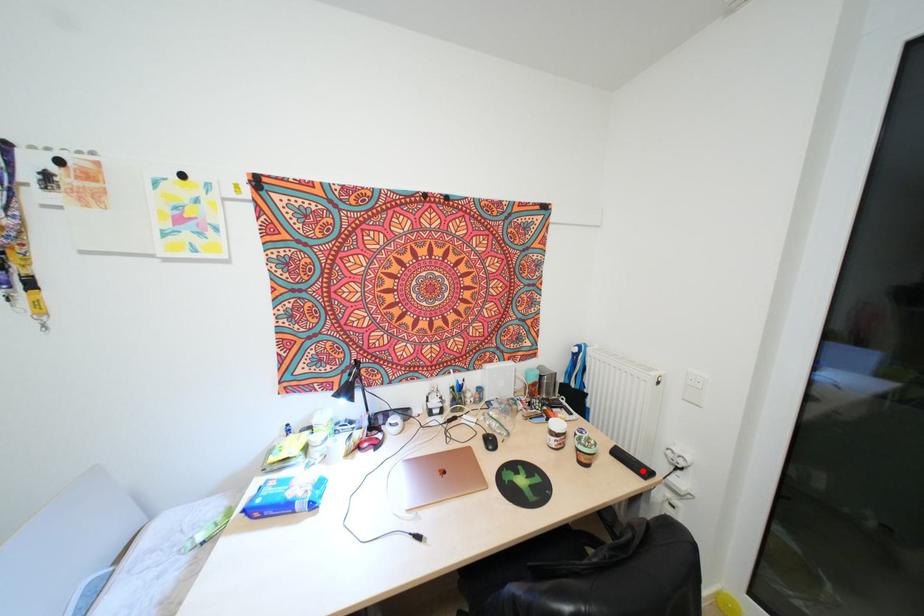
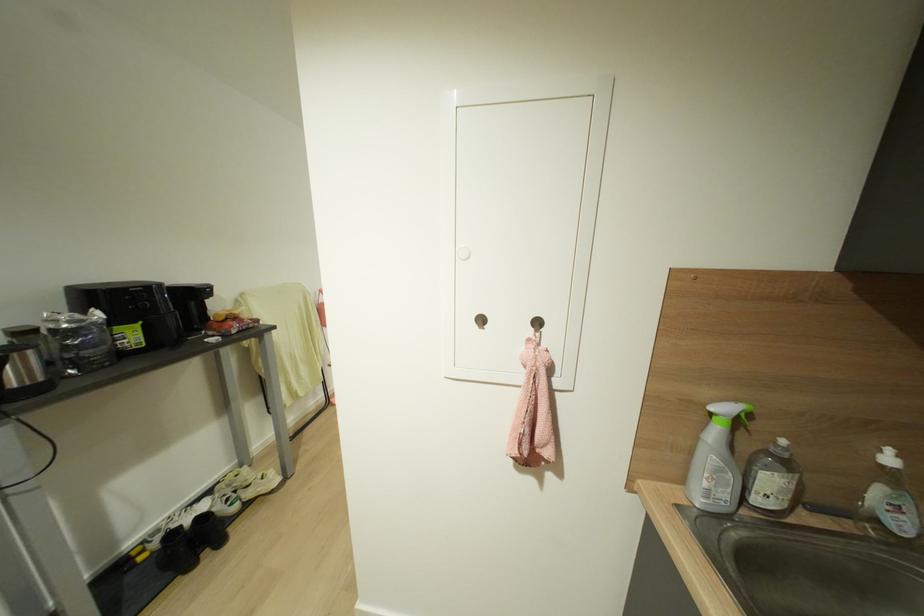
Question: I am providing you with two images of the same scene from different viewpoints. A red point is marked on the first image. Is the red point's position out of view in image 2?

Choices:
 (A) Yes
 (B) No

Answer: (A)